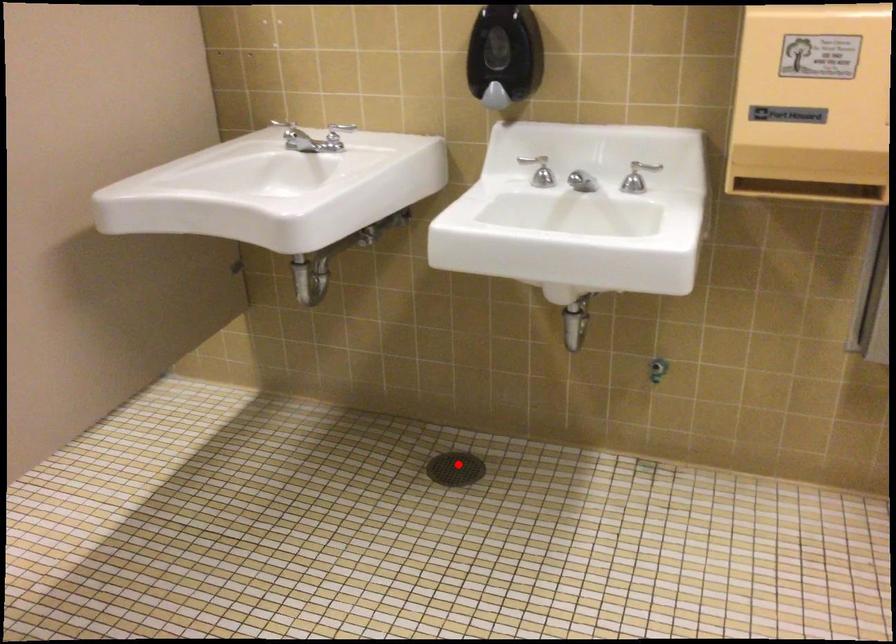
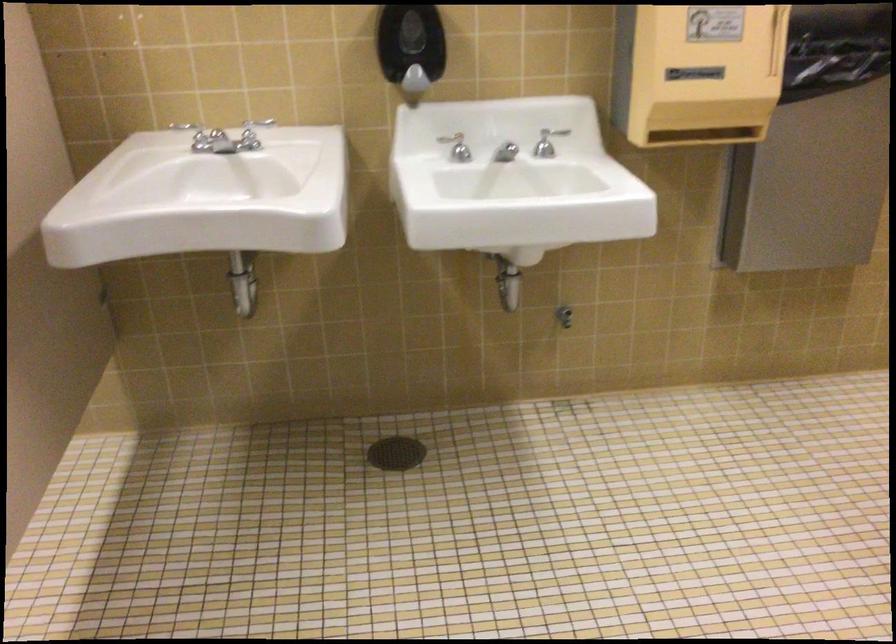
The point at the highlighted location is marked in the first image. Where is the corresponding point in the second image?

(395, 453)